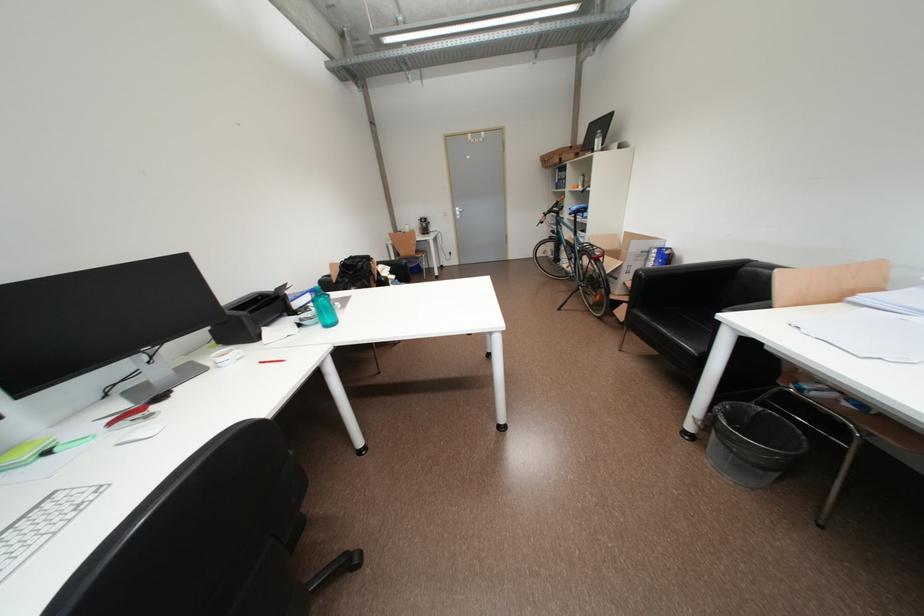
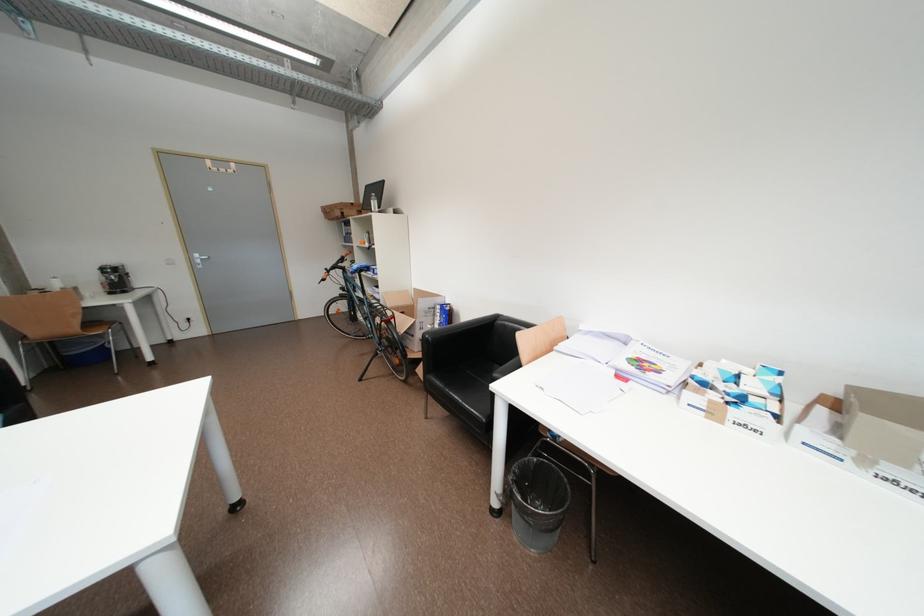
Question: The first image is from the beginning of the video and the second image is from the end. How did the camera likely rotate when shooting the video?

Choices:
 (A) Left
 (B) Right
 (C) Up
 (D) Down

Answer: (B)